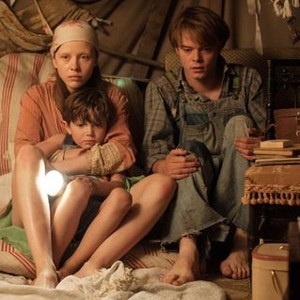
At what (x,y) coordinates should I click in order to perform the action: click on handle on the suitcase on the floor. Please return your answer as a coordinate pair (x, y). Image resolution: width=300 pixels, height=300 pixels. Looking at the image, I should click on (272, 278).